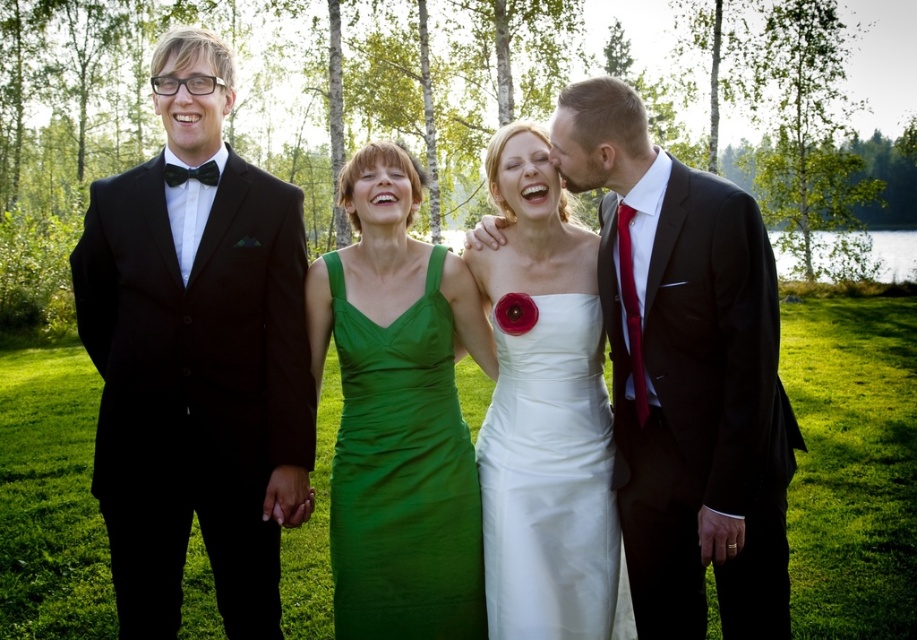
You are a photographer at the event and want to ensure both the black satin suit at left and the matte green dress at center are clearly visible in the photo. Based on their positions, which one is closer to the camera?

The black satin suit at left is positioned over the matte green dress at center, meaning it is closer to the camera.

What is the color of the outfit worn by the person at the point with coordinates (686,372)?

The point at coordinates (686,372) corresponds to the shiny black suit at center, so the color is black.